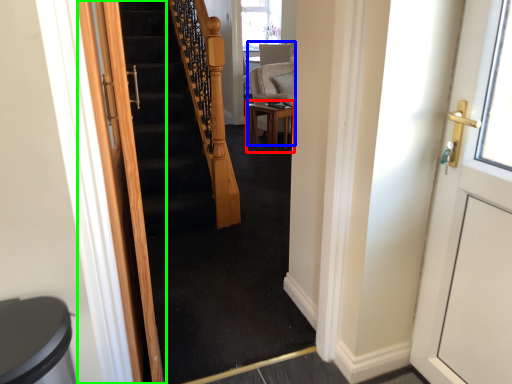
Question: Which object is positioned closest to table (highlighted by a red box)? Select from armchair (highlighted by a blue box) and door (highlighted by a green box).

Choices:
 (A) armchair
 (B) door

Answer: (A)